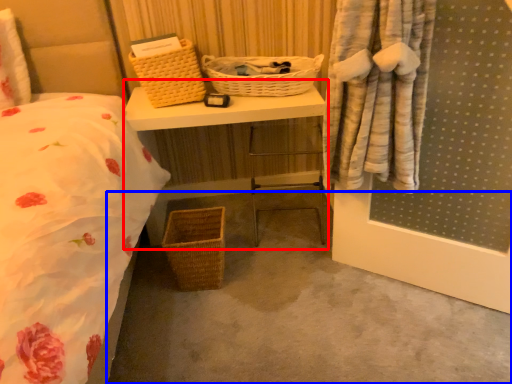
Question: Which point is further to the camera, vanity (highlighted by a red box) or concrete (highlighted by a blue box)?

Choices:
 (A) vanity
 (B) concrete

Answer: (A)